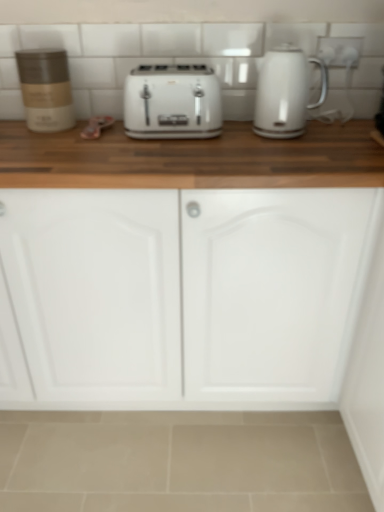
Identify the location of unoccupied region to the right of white glossy toaster at center. The height and width of the screenshot is (512, 384). (244, 137).